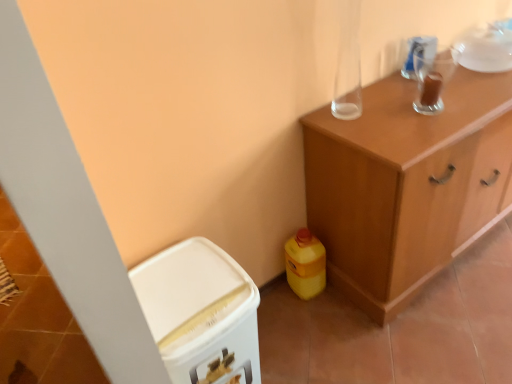
The height and width of the screenshot is (384, 512). Find the location of `free space that is to the left of yellow plastic bottle at lower right`. free space that is to the left of yellow plastic bottle at lower right is located at coordinates (273, 301).